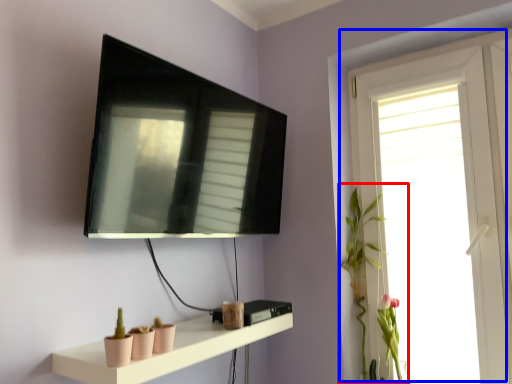
Question: Which point is further to the camera, plant (highlighted by a red box) or window (highlighted by a blue box)?

Choices:
 (A) plant
 (B) window

Answer: (A)